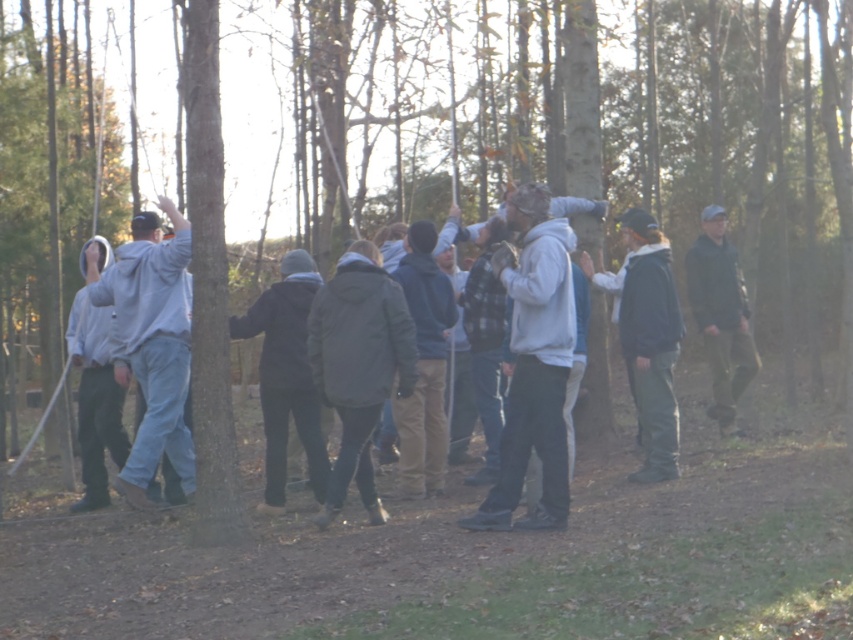
Question: Can you confirm if dark gray hoodie at center is smaller than dark green fabric jacket at right?

Choices:
 (A) no
 (B) yes

Answer: (A)

Question: Which object is farther from the camera taking this photo?

Choices:
 (A) light gray hoodie at left
 (B) dark gray hoodie at center

Answer: (B)

Question: Does matte gray hoodie at center have a greater width compared to light gray hoodie at left?

Choices:
 (A) yes
 (B) no

Answer: (B)

Question: Is light gray hoodie at left above dark gray hoodie at center?

Choices:
 (A) yes
 (B) no

Answer: (A)

Question: Which point appears closest to the camera in this image?

Choices:
 (A) (503, 509)
 (B) (654, 358)
 (C) (96, 289)

Answer: (A)

Question: Which object is farther from the camera taking this photo?

Choices:
 (A) dark green fabric jacket at right
 (B) matte gray hoodie at center
 (C) light gray hoodie at left
 (D) dark gray hoodie at center

Answer: (A)